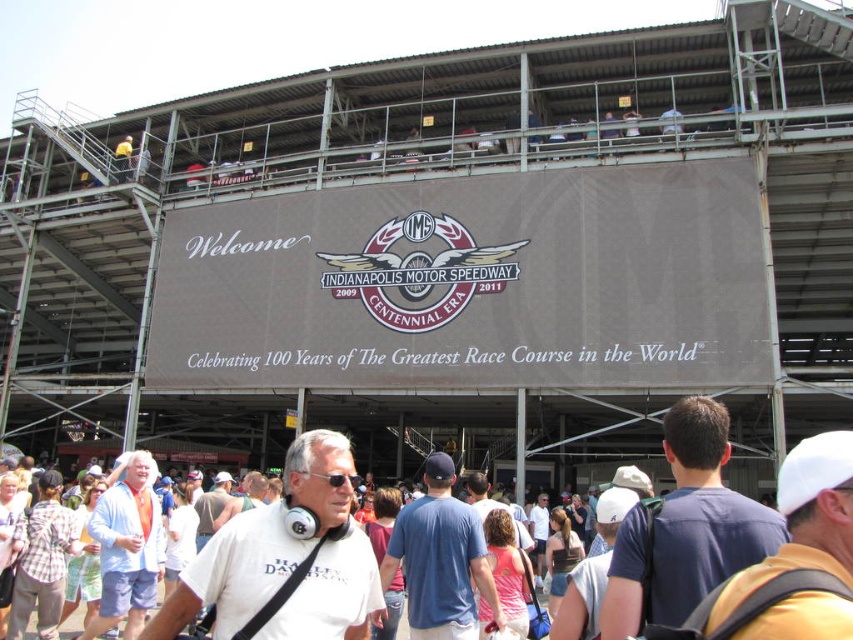
Question: Is dark blue t-shirt at center closer to the viewer compared to blue cotton shirt at center?

Choices:
 (A) no
 (B) yes

Answer: (B)

Question: Which point is closer to the camera?

Choices:
 (A) (432, 628)
 (B) (717, 624)
 (C) (357, 474)

Answer: (B)

Question: Is dark blue t-shirt at center to the right of white matte baseball cap at upper right from the viewer's perspective?

Choices:
 (A) yes
 (B) no

Answer: (B)

Question: Among these points, which one is nearest to the camera?

Choices:
 (A) (292, 554)
 (B) (428, 484)
 (C) (751, 520)

Answer: (C)

Question: Estimate the real-world distances between objects in this image. Which object is farther from the white matte baseball cap at upper right?

Choices:
 (A) blue cotton shirt at center
 (B) orange-cotton shirt at lower left

Answer: (B)

Question: Can you confirm if white matte t-shirt at center is bigger than dark blue t-shirt at center?

Choices:
 (A) yes
 (B) no

Answer: (A)